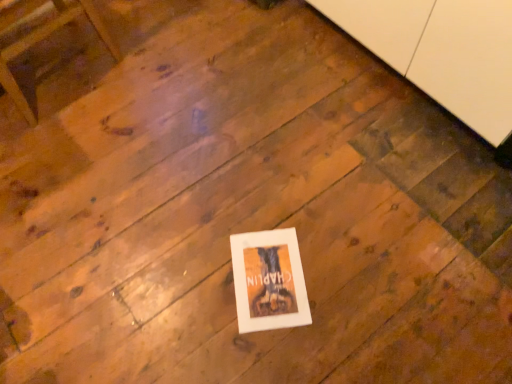
Identify the location of free location in front of wooden chair at upper left. (72, 145).